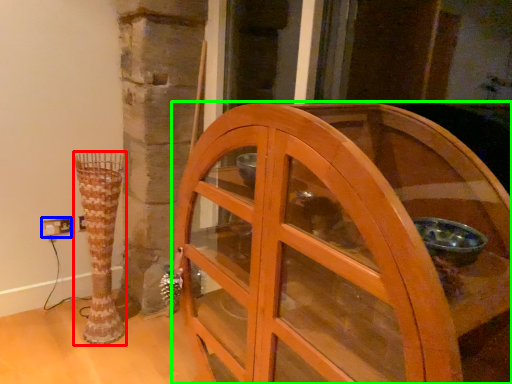
Question: Which object is the farthest from vase (highlighted by a red box)? Choose among these: electric outlet (highlighted by a blue box) or furniture (highlighted by a green box).

Choices:
 (A) electric outlet
 (B) furniture

Answer: (B)